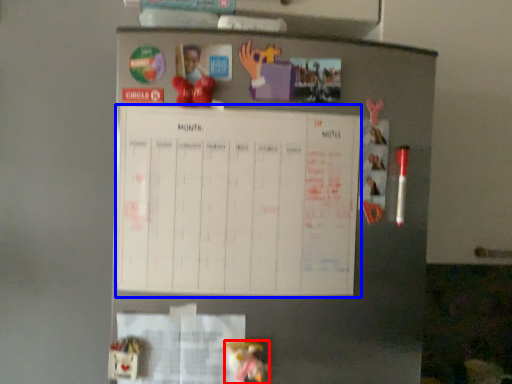
Question: Which of the following is the farthest to the observer, toy (highlighted by a red box) or bulletin board (highlighted by a blue box)?

Choices:
 (A) toy
 (B) bulletin board

Answer: (B)